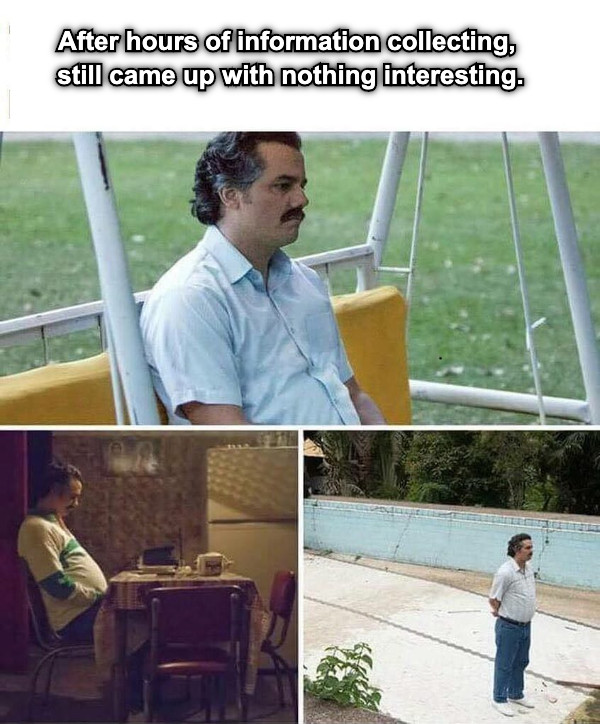
Locate an element on the screen. The width and height of the screenshot is (600, 724). wall crack is located at coordinates (400, 539).